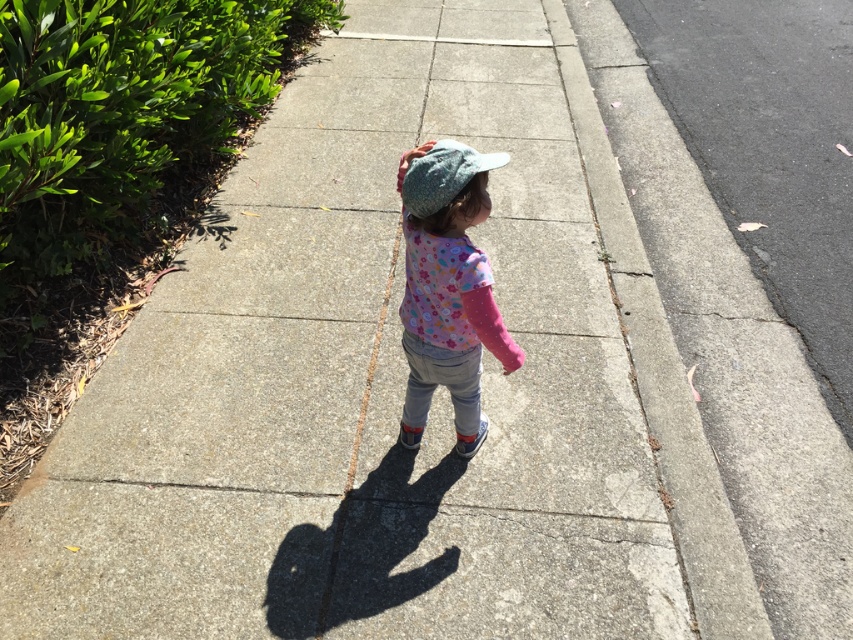
You are a photographer trying to capture the child in the image. You want to ensure both the fluffy cotton hat at center and the knitted blue cap at center are clearly visible in the photo. Which object should you focus on first to ensure both are in frame?

You should focus on the fluffy cotton hat at center first because the knitted blue cap at center is behind it, so ensuring the fluffy cotton hat at center is positioned correctly will allow the knitted blue cap at center to be visible behind it.

You are a delivery robot that needs to place a package on the sidewalk. The package is the size of the fluffy cotton hat at center. Can you place it on the gray concrete curb at right without it falling off?

The gray concrete curb at right is larger in size than the fluffy cotton hat at center, so yes, the package can be placed on the gray concrete curb at right without falling off as there is enough space.